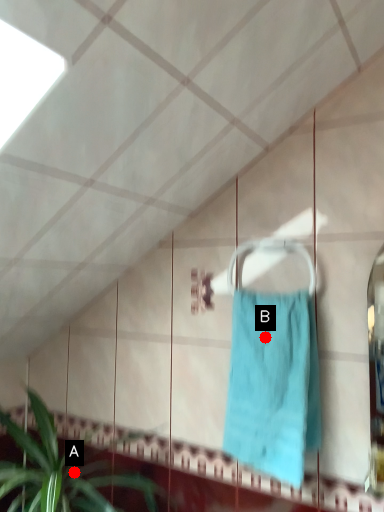
Question: Two points are circled on the image, labeled by A and B beside each circle. Among these points, which one is nearest to the camera?

Choices:
 (A) A is closer
 (B) B is closer

Answer: (B)